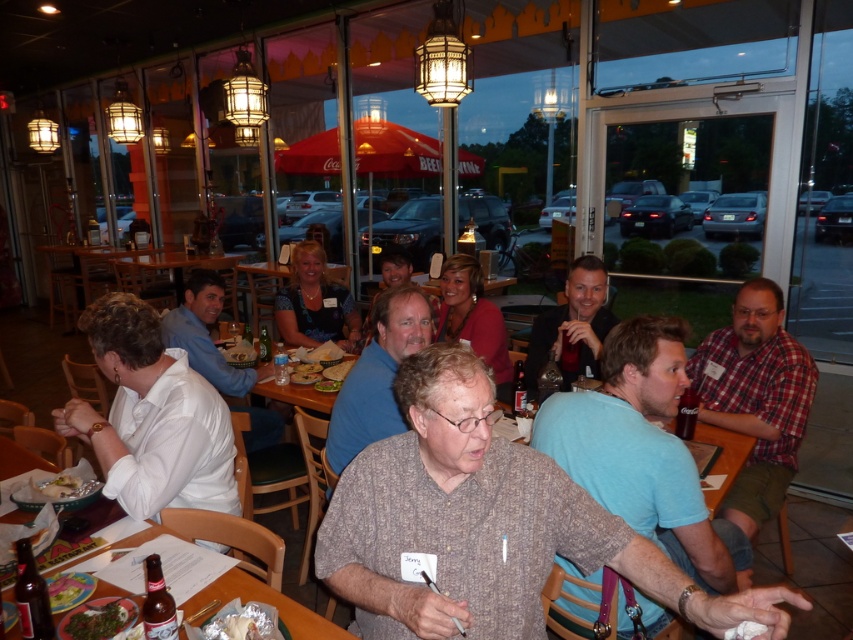
Question: Which object is positioned farthest from the green matte salad bowl at lower left?

Choices:
 (A) wooden table at center
 (B) blue cotton shirt at center
 (C) light blue shirt at center
 (D) green leafy vegetable at lower left

Answer: (C)

Question: Is green matte salad bowl at lower left positioned at the back of green leafy salad at center?

Choices:
 (A) no
 (B) yes

Answer: (A)

Question: Is matte black shirt at center wider than green leafy salad at center?

Choices:
 (A) yes
 (B) no

Answer: (A)

Question: Which object appears farthest from the camera in this image?

Choices:
 (A) green leafy vegetable at lower left
 (B) blue shirt at center
 (C) green leafy salad at center
 (D) wooden table at center

Answer: (C)

Question: Does blue cotton shirt at center come in front of green leafy vegetable at lower left?

Choices:
 (A) no
 (B) yes

Answer: (A)

Question: Which point appears closest to the camera in this image?

Choices:
 (A) (711, 404)
 (B) (99, 608)
 (C) (656, 554)
 (D) (676, 461)

Answer: (C)